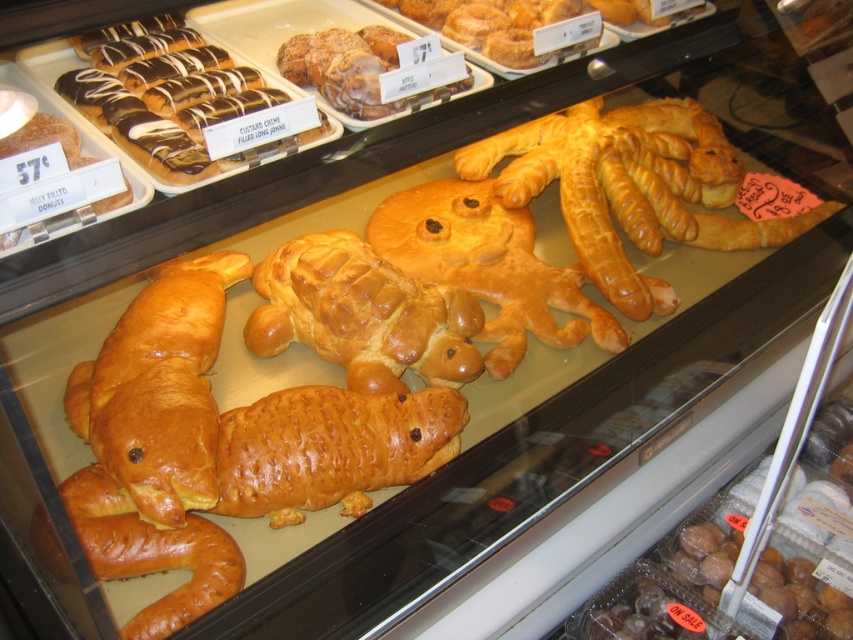
Question: Can you confirm if golden brown crusty pastry at center is positioned to the right of golden brown braided pastry at center?

Choices:
 (A) no
 (B) yes

Answer: (B)

Question: Is golden brown croissant at left wider than golden brown crusty pastry at center?

Choices:
 (A) no
 (B) yes

Answer: (A)

Question: Which object appears farthest from the camera in this image?

Choices:
 (A) golden brown crusty pastry at center
 (B) golden brown braided pastry at center

Answer: (B)

Question: Which point is closer to the camera taking this photo?

Choices:
 (A) (119, 465)
 (B) (396, 413)

Answer: (A)

Question: Among these points, which one is nearest to the camera?

Choices:
 (A) [94, 557]
 (B) [276, 396]
 (C) [154, 300]
 (D) [422, 348]

Answer: (A)

Question: Is golden brown croissant at left to the left of golden brown braided pastry at center from the viewer's perspective?

Choices:
 (A) yes
 (B) no

Answer: (A)